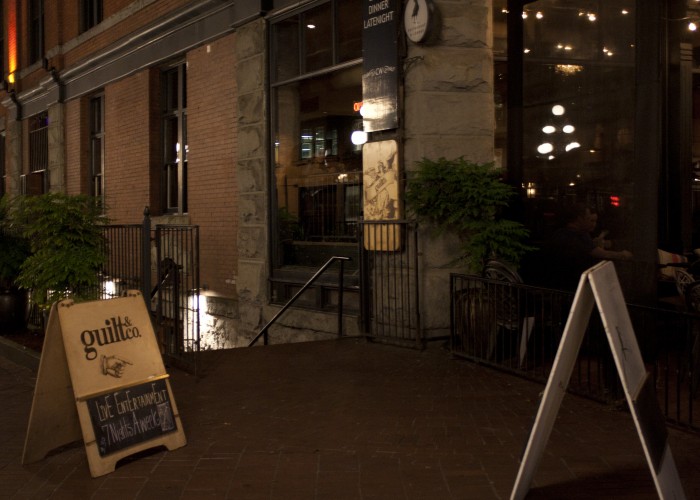
At what (x,y) coordinates should I click in order to perform the action: click on stair rail. Please return your answer as a coordinate pair (x, y). Looking at the image, I should click on [x=329, y=261].